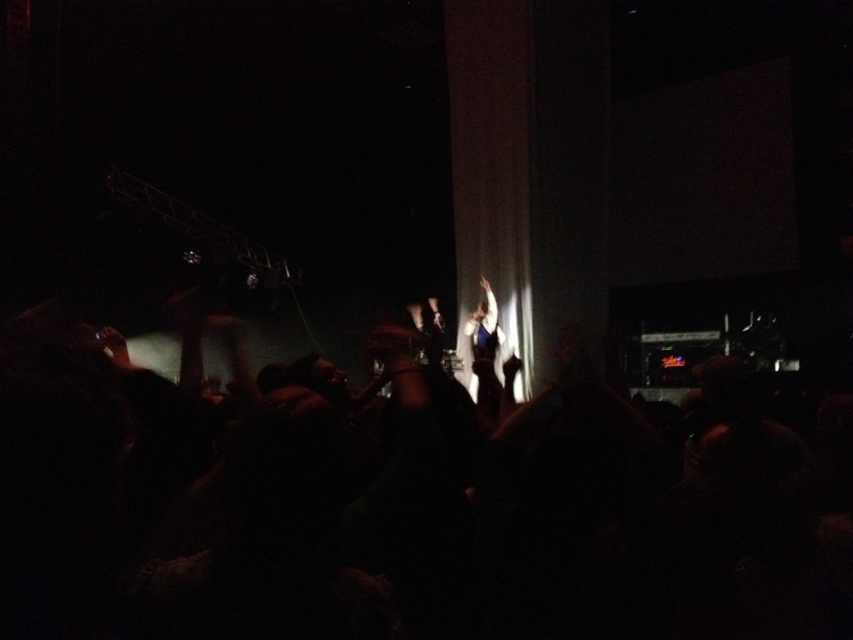
In the concert scene, there are a black fabric crowd at center and a shiny blue dress at center. Which one is taller?

The black fabric crowd at center is much taller as shiny blue dress at center.

You are at the concert venue and want to find a spot where you can see both the performer and the large screen in the background. Based on the image, is the point at coordinates (412, 513) a good location for this?

The point at coordinates (412, 513) is occupied by the black fabric crowd at center, so it might not be a good location for seeing both the performer and the large screen clearly due to the crowd obstruction.

You are a photographer at the concert. You want to capture a photo where the shiny blue dress at center is on the right side of the black fabric crowd at center. Based on the scene description, is this possible?

The black fabric crowd at center is to the left of shiny blue dress at center, so yes, the shiny blue dress at center will naturally appear on the right side of the black fabric crowd at center in the photo.